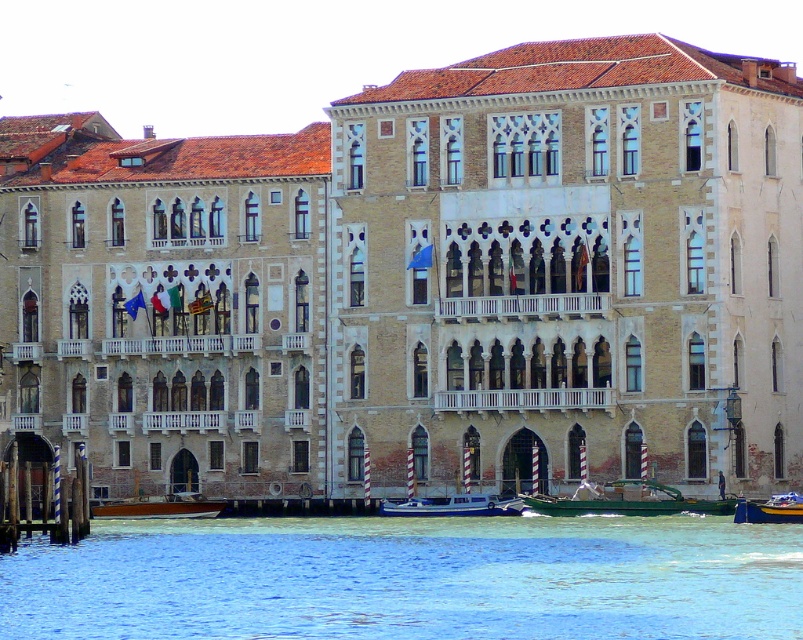
Question: Which point appears farthest from the camera in this image?

Choices:
 (A) (164, 516)
 (B) (797, 509)

Answer: (A)

Question: Is white glossy boat at center to the left of wooden polished boat at lower left from the viewer's perspective?

Choices:
 (A) no
 (B) yes

Answer: (A)

Question: Which of the following is the farthest from the observer?

Choices:
 (A) (x=506, y=588)
 (B) (x=785, y=500)
 (C) (x=166, y=516)

Answer: (C)

Question: Can you confirm if clear blue water at lower center is positioned to the left of white glossy boat at center?

Choices:
 (A) yes
 (B) no

Answer: (B)

Question: Is green matte boat at lower center below wooden polished boat at lower left?

Choices:
 (A) no
 (B) yes

Answer: (A)

Question: Which of the following is the farthest from the observer?

Choices:
 (A) (15, 582)
 (B) (667, 492)

Answer: (B)